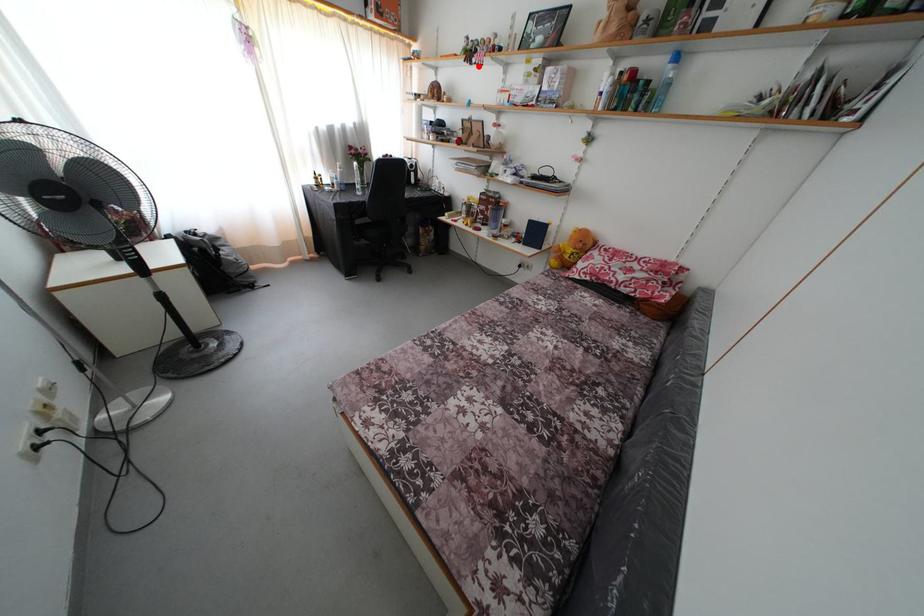
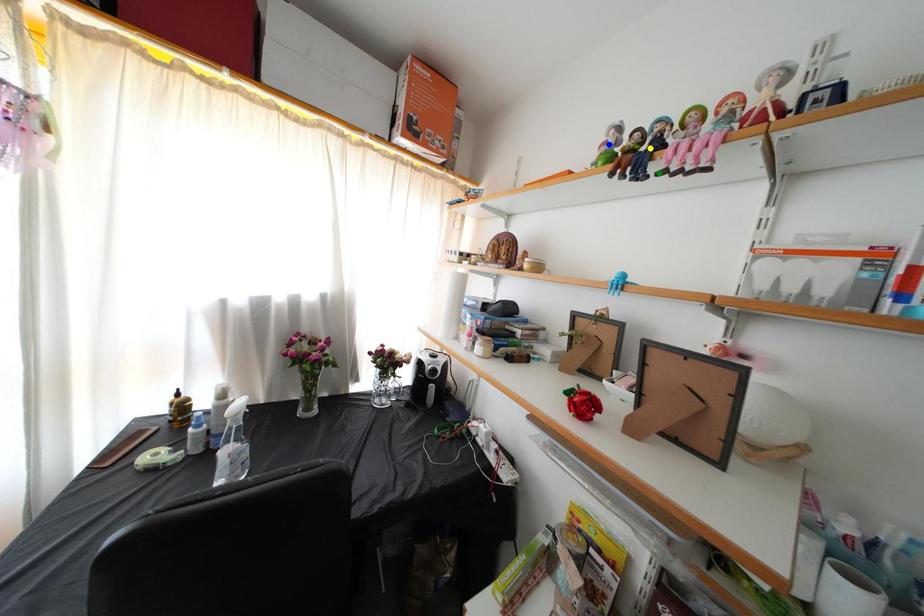
Question: I am providing you with two images of the same scene from different viewpoints. A red point is marked on the first image. You are given multiple points on the second image. Can you choose the point in image 2 that corresponds to the point in image 1?

Choices:
 (A) yellow point
 (B) blue point
 (C) green point

Answer: (C)